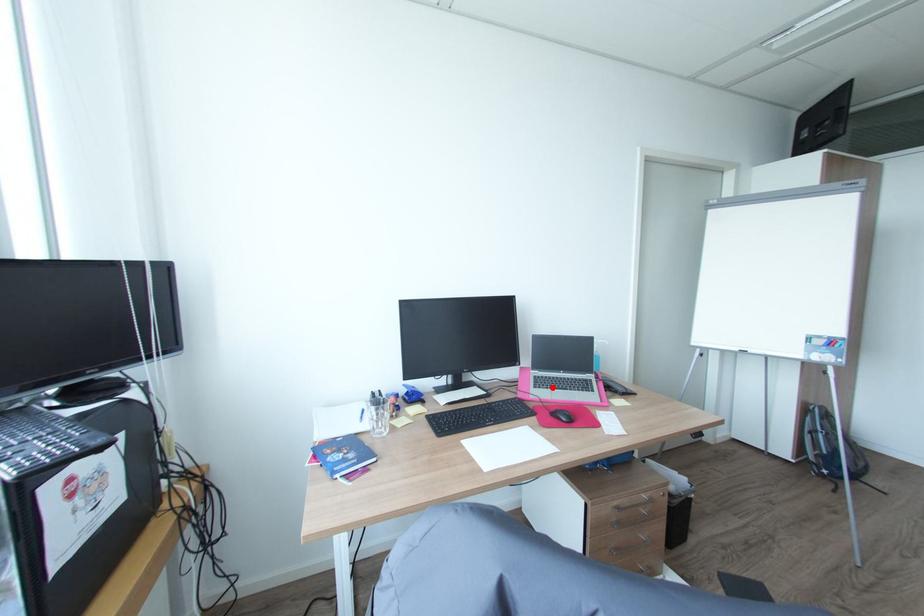
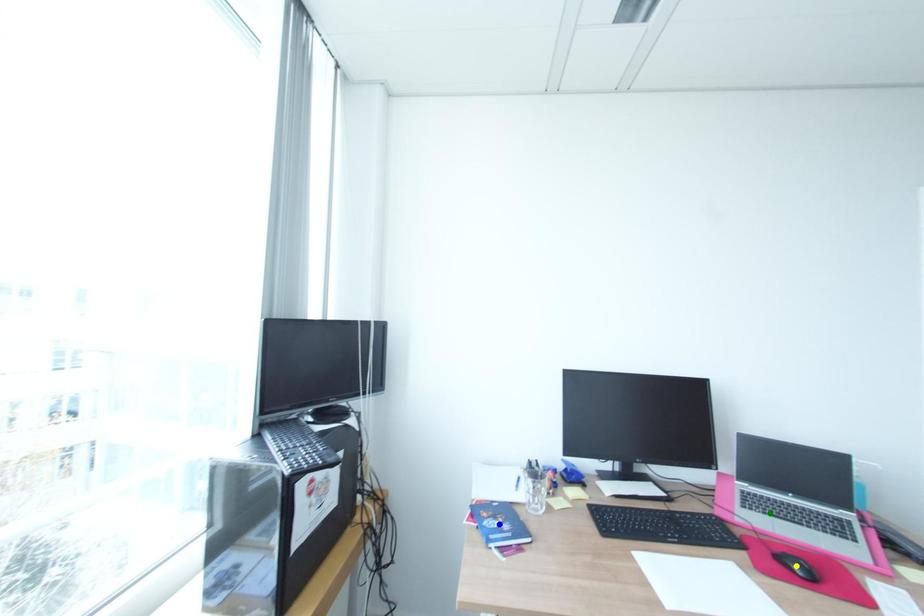
Question: I am providing you with two images of the same scene from different viewpoints. A red point is marked on the first image. You are given multiple points on the second image. Which spot in image 2 lines up with the point in image 1?

Choices:
 (A) blue point
 (B) yellow point
 (C) green point

Answer: (C)